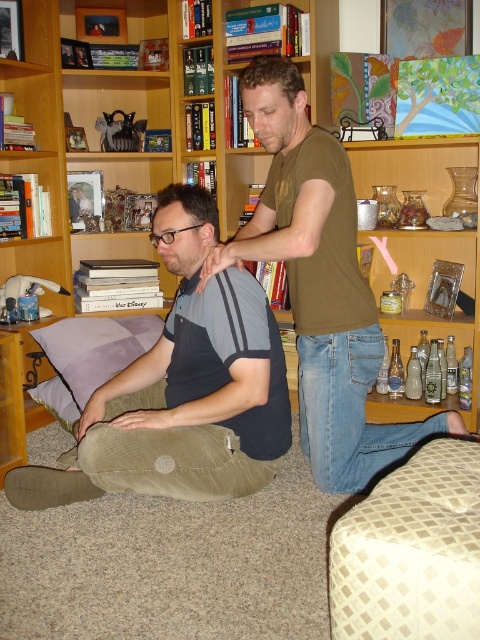
Question: Is wooden bookshelf at center positioned in front of beige checkered stool at lower right?

Choices:
 (A) no
 (B) yes

Answer: (A)

Question: Can you confirm if dark gray cotton shirt at center is bigger than dark brown hair at center?

Choices:
 (A) no
 (B) yes

Answer: (B)

Question: Considering the relative positions of dark gray cotton shirt at center and brown hair at upper center in the image provided, where is dark gray cotton shirt at center located with respect to brown hair at upper center?

Choices:
 (A) above
 (B) below

Answer: (B)

Question: Which point appears closest to the camera in this image?

Choices:
 (A) (425, 444)
 (B) (240, 77)
 (C) (257, 157)
 (D) (63, 353)

Answer: (A)

Question: Which object is positioned closest to the wooden bookshelf at center?

Choices:
 (A) beige checkered stool at lower right
 (B) dark brown hair at center
 (C) purple fabric pillow at lower left
 (D) matte brown shirt at center

Answer: (C)

Question: Which point appears farthest from the camera in this image?

Choices:
 (A) (38, 253)
 (B) (204, 484)

Answer: (A)